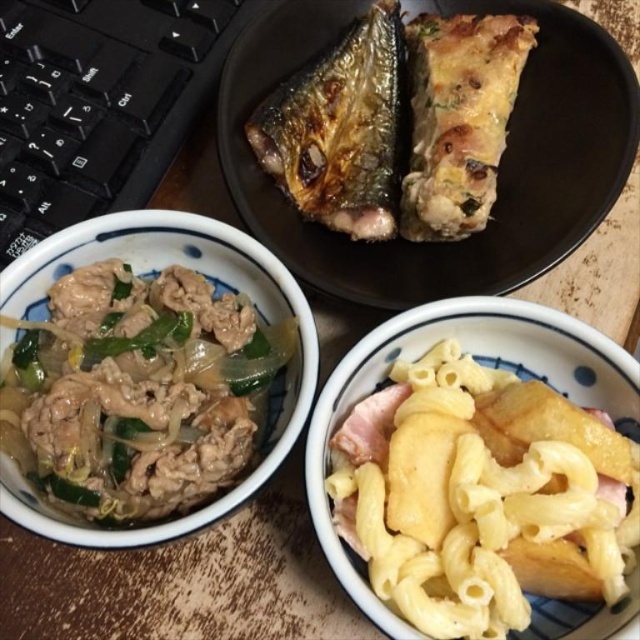
You are looking at the wooden surface with the meal setup. There are two points marked on the image. Which point, point 1 at coordinates (627,170) or point 2 at coordinates (378,204), is closer to you?

Point 1 at coordinates (627,170) is closer to the viewer than point 2 at coordinates (378,204).

You are a delivery person who needs to place a small package on the wooden surface where the meal is set up. The package must be placed at the exact coordinates of the yellow matte pasta at lower right. What are the coordinates where you should place the package?

The coordinates for the yellow matte pasta at lower right are at point (481,496).